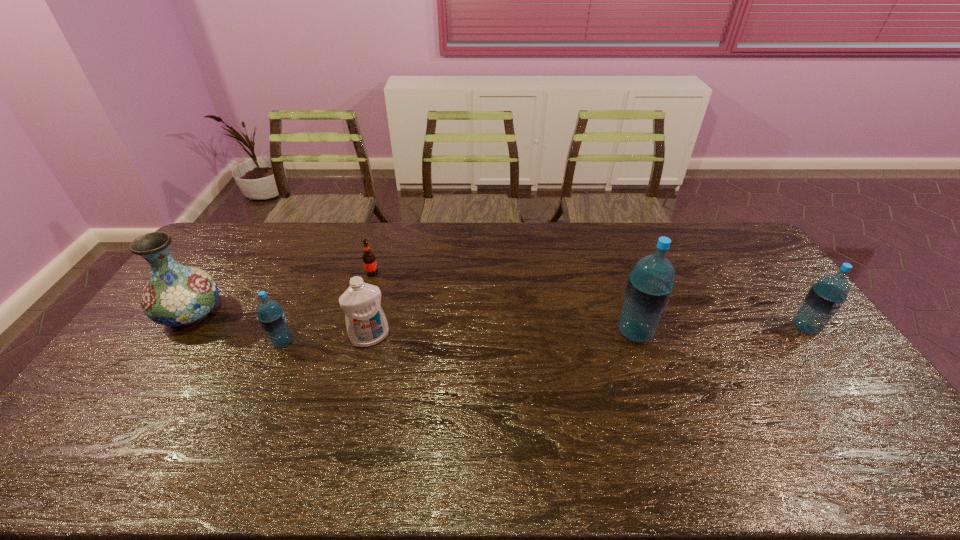
Find the location of a particular element. This screenshot has width=960, height=540. location for an additional water_bottle to make spacing equal is located at coordinates (461, 337).